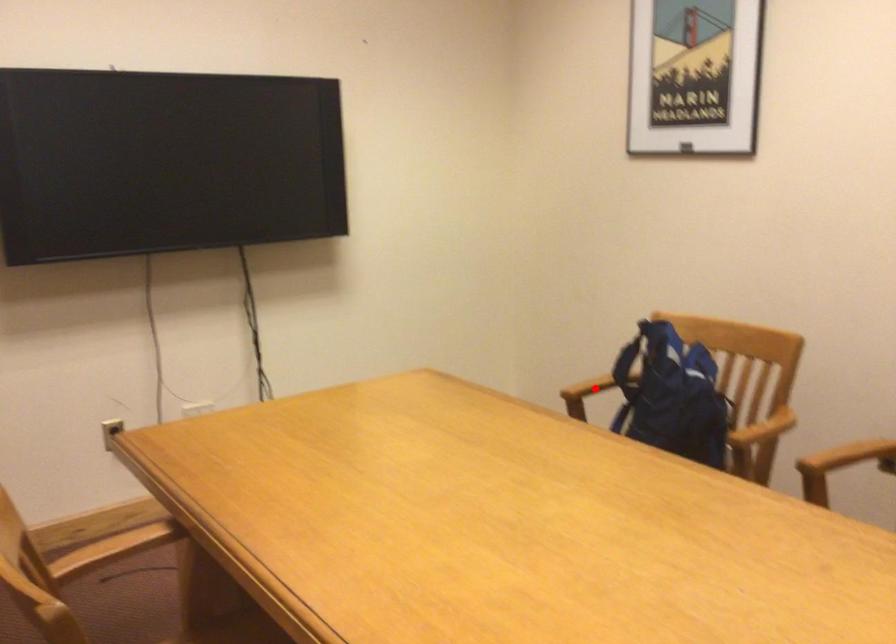
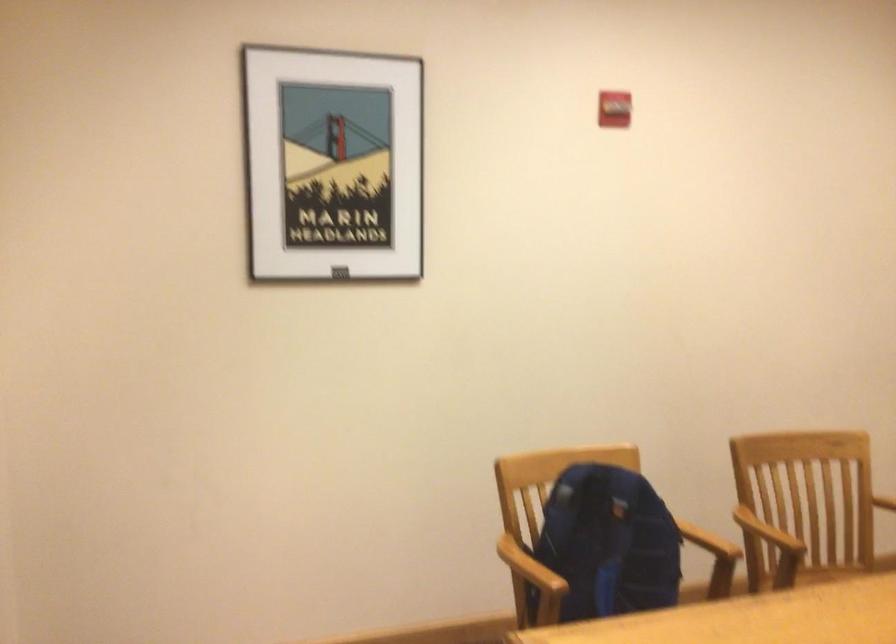
Where in the second image is the point corresponding to the highlighted location from the first image?

(530, 567)